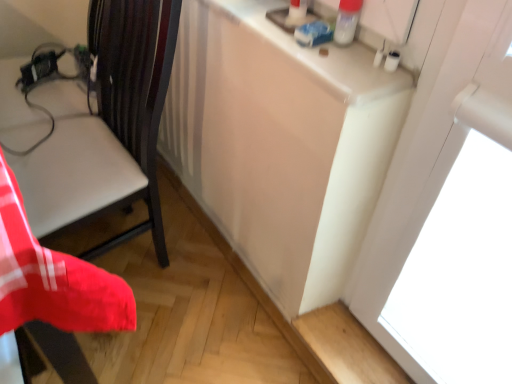
Identify the location of free space below matte black chair at left (from a real-world perspective). (130, 246).